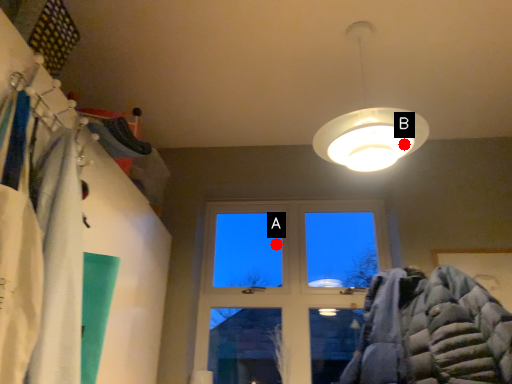
Question: Two points are circled on the image, labeled by A and B beside each circle. Which point appears farthest from the camera in this image?

Choices:
 (A) A is further
 (B) B is further

Answer: (A)